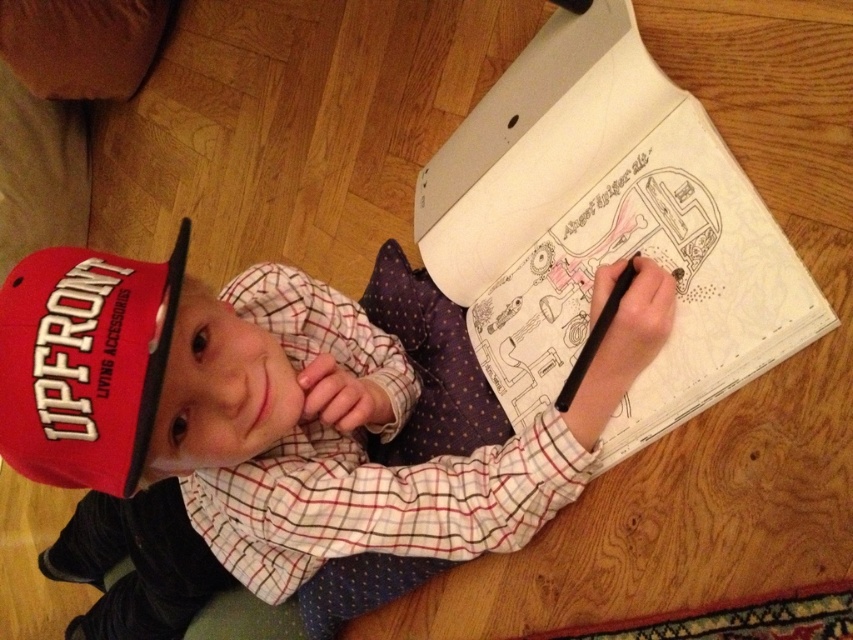
Question: Which object is positioned farthest from the white paper at center?

Choices:
 (A) red matte cap at upper left
 (B) matte red cap at upper left

Answer: (B)

Question: Does white paper at center have a smaller size compared to matte red cap at upper left?

Choices:
 (A) yes
 (B) no

Answer: (B)

Question: Can you confirm if white paper at center is positioned above matte red cap at upper left?

Choices:
 (A) no
 (B) yes

Answer: (B)

Question: Among these points, which one is nearest to the camera?

Choices:
 (A) (61, 246)
 (B) (625, 109)

Answer: (B)

Question: Considering the real-world distances, which object is farthest from the white paper at center?

Choices:
 (A) matte red cap at upper left
 (B) red matte cap at upper left

Answer: (A)

Question: Does white paper at center have a smaller size compared to matte red cap at upper left?

Choices:
 (A) yes
 (B) no

Answer: (B)